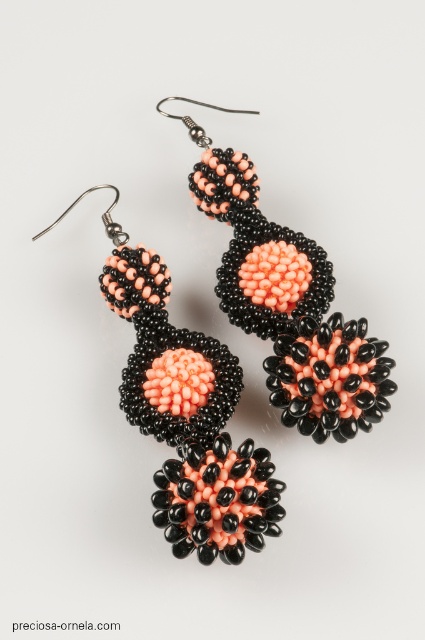
Looking at this image, you are a jeweler examining the coral matte and black beaded earrings at center. What is the color of the beads located at the coordinates point (187, 413)?

The point (187, 413) corresponds to the coral matte and black beaded earrings at center.